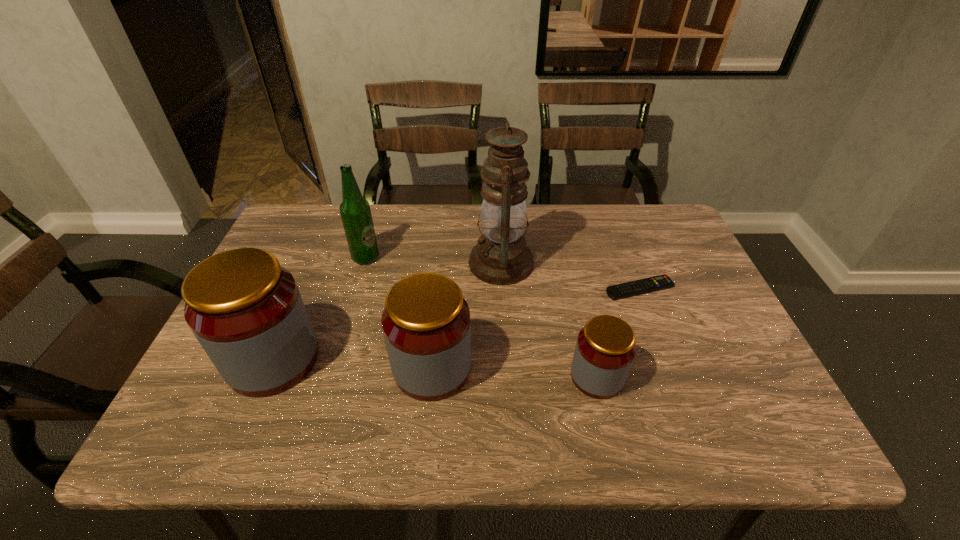
The height and width of the screenshot is (540, 960). Find the location of `vacant space that satisfies the following two spatial constraints: 1. on the label of the beer bottle; 2. on the right side of the second tallest jar`. vacant space that satisfies the following two spatial constraints: 1. on the label of the beer bottle; 2. on the right side of the second tallest jar is located at coordinates (334, 368).